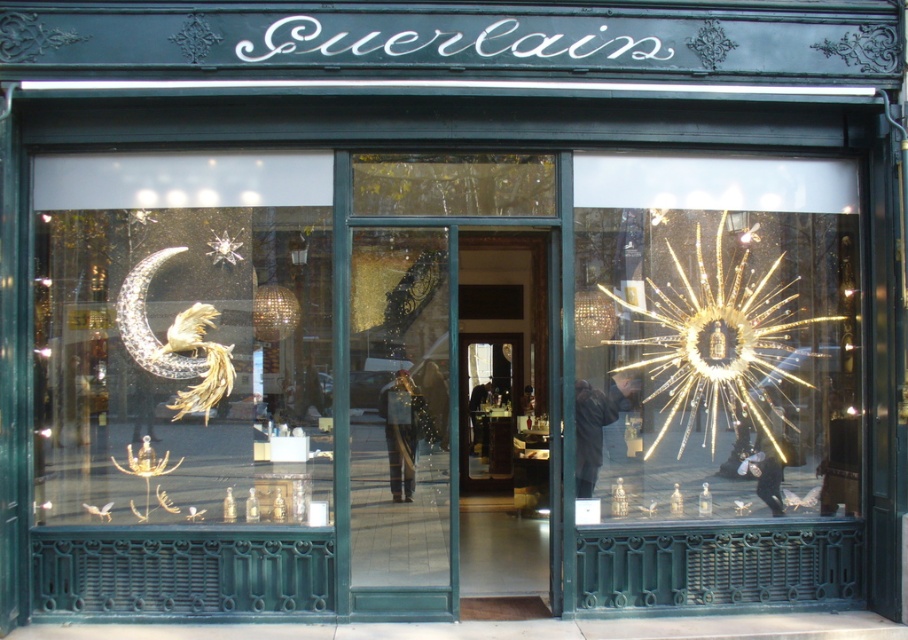
Who is taller, shiny gold crescent moon at left or shiny gold starburst at center?

shiny gold starburst at center

This screenshot has height=640, width=908. Identify the location of shiny gold crescent moon at left. [x=183, y=381].

Image resolution: width=908 pixels, height=640 pixels. Identify the location of shiny gold crescent moon at left. (183, 381).

What do you see at coordinates (183, 381) in the screenshot?
I see `shiny gold crescent moon at left` at bounding box center [183, 381].

Measure the distance between shiny gold crescent moon at left and transparent glass door at center.

4.51 meters

What are the coordinates of `shiny gold crescent moon at left` in the screenshot? It's located at (183, 381).

Identify the location of shiny gold crescent moon at left. (183, 381).

Consider the image. Which is below, shiny gold starburst at center or transparent glass door at center?

transparent glass door at center is below.

Is shiny gold starburst at center thinner than transparent glass door at center?

Incorrect, shiny gold starburst at center's width is not less than transparent glass door at center's.

Does point (822, 280) come farther from viewer compared to point (350, 433)?

Yes, point (822, 280) is behind point (350, 433).

At what (x,y) coordinates should I click in order to perform the action: click on shiny gold starburst at center. Please return your answer as a coordinate pair (x, y). This screenshot has width=908, height=640. Looking at the image, I should click on (716, 378).